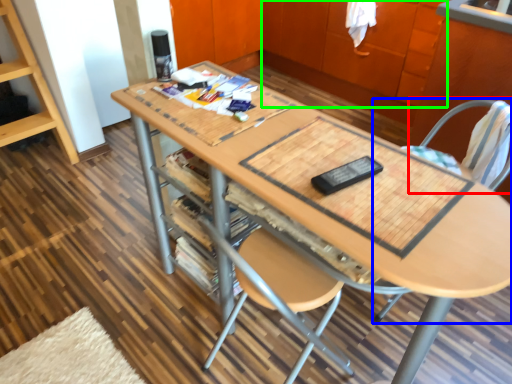
Question: Which is farther away from swivel chair (highlighted by a red box)? chair (highlighted by a blue box) or cabinetry (highlighted by a green box)?

Choices:
 (A) chair
 (B) cabinetry

Answer: (B)